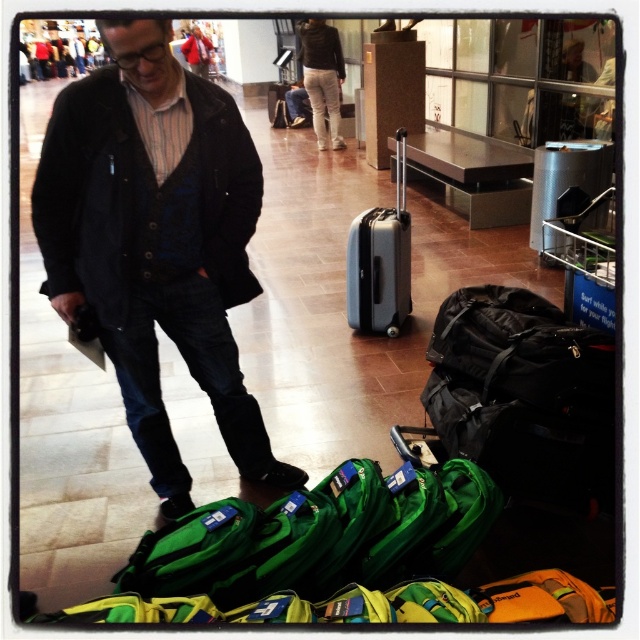
Question: Can you confirm if dark blue jeans at lower left is positioned to the right of silver metallic suitcase at center?

Choices:
 (A) yes
 (B) no

Answer: (B)

Question: Observing the image, what is the correct spatial positioning of dark blue jeans at lower left in reference to silver metallic suitcase at center?

Choices:
 (A) right
 (B) left

Answer: (B)

Question: Can you confirm if dark blue jeans at lower left is wider than silver metallic suitcase at center?

Choices:
 (A) no
 (B) yes

Answer: (B)